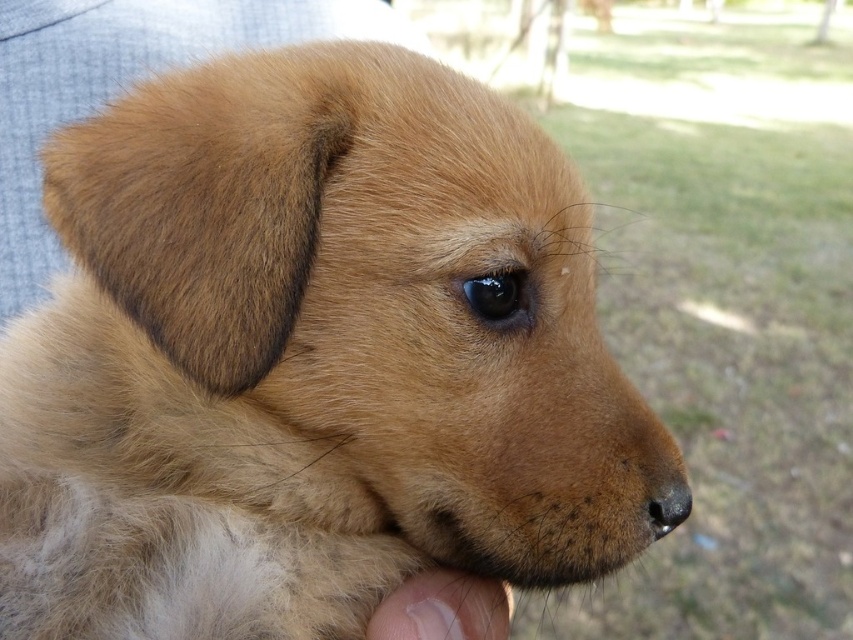
You are a photographer adjusting your camera to focus on two specific points in the image of the puppy. The first point is at coordinates point (421, 627) and the second is at point (666, 490). Which point should you focus on first if you want to ensure the closer one is in sharp focus?

Point (421, 627) is closer to the viewer than point (666, 490), so you should focus on point (421, 627) first to ensure it is in sharp focus.